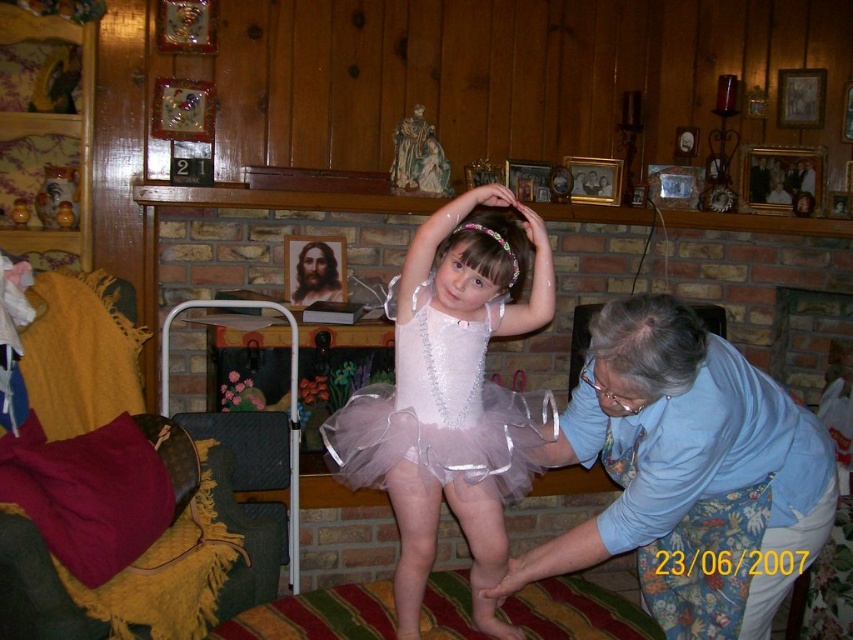
Question: Can you confirm if blue floral apron at lower right is positioned to the right of pale pink tulle tutu at center?

Choices:
 (A) yes
 (B) no

Answer: (A)

Question: Can you confirm if blue floral apron at lower right is positioned to the left of pale pink tulle tutu at center?

Choices:
 (A) yes
 (B) no

Answer: (B)

Question: Among these points, which one is nearest to the camera?

Choices:
 (A) (579, 424)
 (B) (418, 600)

Answer: (A)

Question: Which object is closer to the camera taking this photo?

Choices:
 (A) blue floral apron at lower right
 (B) pale pink tulle tutu at center

Answer: (A)

Question: Is blue floral apron at lower right wider than pale pink tulle tutu at center?

Choices:
 (A) no
 (B) yes

Answer: (B)